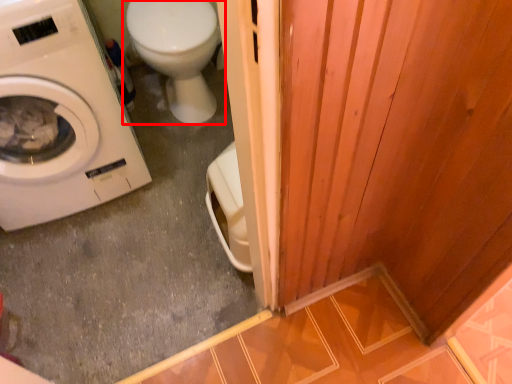
Question: Observing the image, what is the correct spatial positioning of toilet (annotated by the red box) in reference to washing machine?

Choices:
 (A) left
 (B) right

Answer: (B)